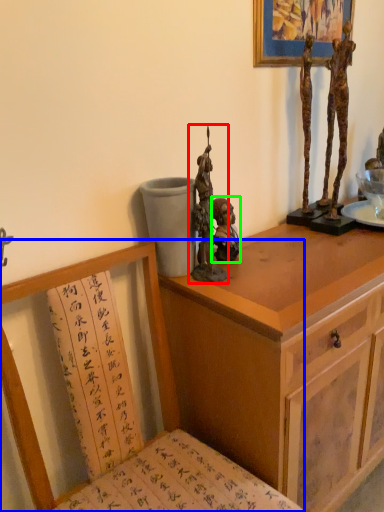
Question: Considering the real-world distances, which object is farthest from sculpture (highlighted by a red box)? chair (highlighted by a blue box) or person (highlighted by a green box)?

Choices:
 (A) chair
 (B) person

Answer: (A)